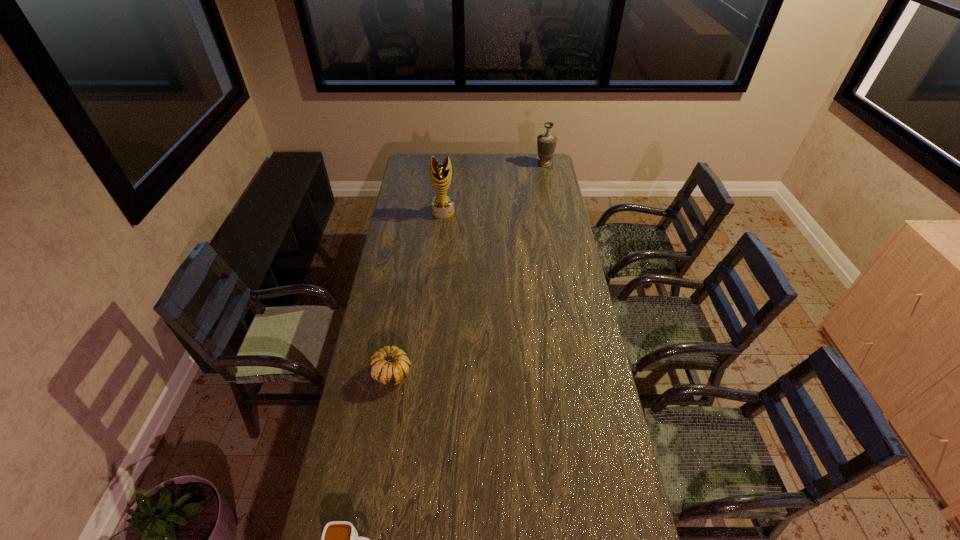
You are a GUI agent. You are given a task and a screenshot of the screen. Output one action in this format:
    pyautogui.click(x=<x>, y=<y>)
    Task: Click on the award
    The width and height of the screenshot is (960, 540).
    Given the screenshot: What is the action you would take?
    pyautogui.click(x=442, y=205)

Where is `the tallest object`? Image resolution: width=960 pixels, height=540 pixels. the tallest object is located at coordinates (442, 205).

What are the coordinates of `the farthest object` in the screenshot? It's located at (546, 143).

Find the location of `urn`. urn is located at coordinates (546, 143).

At what (x,y) coordinates should I click in order to perform the action: click on gourd. Please return your answer as a coordinate pair (x, y). This screenshot has width=960, height=540. Looking at the image, I should click on (390, 365).

Image resolution: width=960 pixels, height=540 pixels. In order to click on the third tallest object in this screenshot , I will do `click(390, 365)`.

The image size is (960, 540). Identify the location of free space located on the front-facing side of the tallest object. (439, 258).

This screenshot has height=540, width=960. What are the coordinates of `vacant space positioned on the left of the farthest object` in the screenshot? It's located at (472, 164).

Locate an element on the screen. The width and height of the screenshot is (960, 540). vacant area situated on the right of the second nearest object is located at coordinates (468, 373).

Where is `object that is at the far edge`? The image size is (960, 540). object that is at the far edge is located at coordinates 546,143.